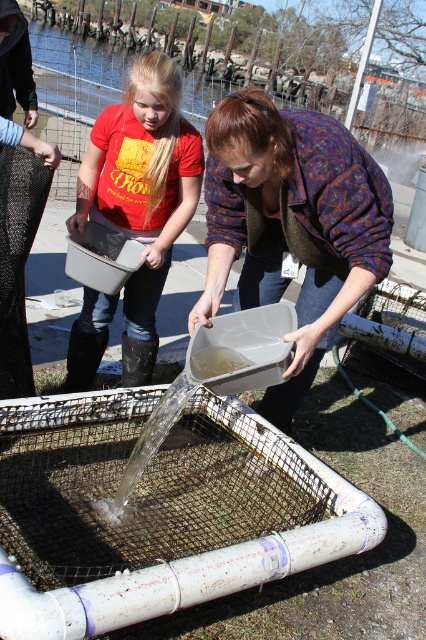
Which is below, matte plastic tray at center or matte plastic bucket at left?

Positioned lower is matte plastic tray at center.

Which of these two, matte plastic tray at center or matte plastic bucket at left, stands shorter?

matte plastic tray at center

This screenshot has height=640, width=426. Identify the location of matte plastic tray at center. (291, 225).